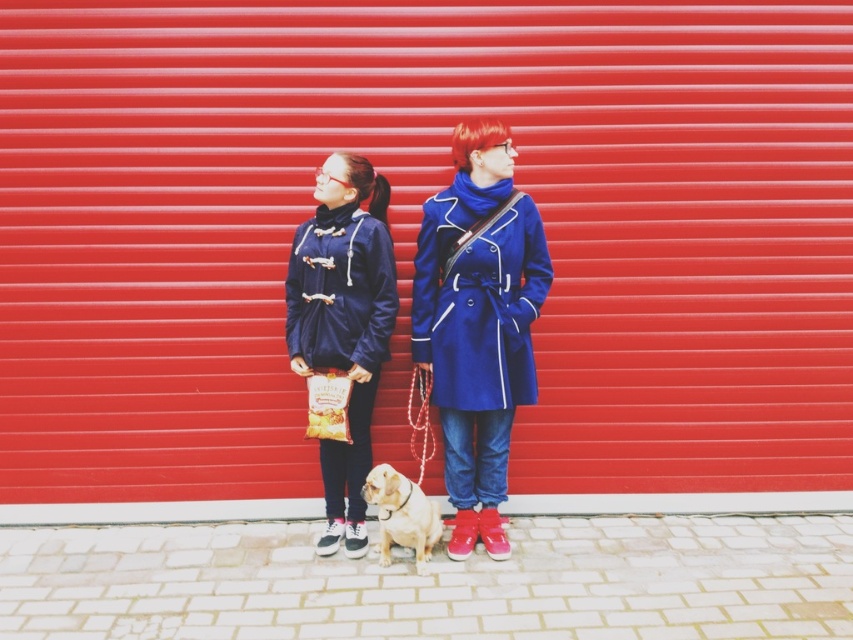
What do you see at coordinates (479, 321) in the screenshot?
I see `matte blue coat at center` at bounding box center [479, 321].

Does point (476, 221) lie behind point (345, 512)?

No, it is in front of (345, 512).

Describe the element at coordinates (479, 321) in the screenshot. This screenshot has height=640, width=853. I see `matte blue coat at center` at that location.

Find the location of `matte blue coat at center`. matte blue coat at center is located at coordinates (479, 321).

Is point (460, 552) positioned in front of point (445, 314)?

No.

Is matte blue coat at center taller than blue woolen coat at center?

Correct, matte blue coat at center is much taller as blue woolen coat at center.

Between point (480, 138) and point (494, 230), which one is positioned behind?

Point (494, 230)

At what (x,y) coordinates should I click in order to perform the action: click on matte blue coat at center. Please return your answer as a coordinate pair (x, y). This screenshot has width=853, height=640. Looking at the image, I should click on (479, 321).

Consider the image. Is matte blue coat at center taller than golden fur dog at center?

Correct, matte blue coat at center is much taller as golden fur dog at center.

Can you confirm if matte blue coat at center is wider than golden fur dog at center?

Correct, the width of matte blue coat at center exceeds that of golden fur dog at center.

Between point (515, 266) and point (389, 522), which one is positioned behind?

The point (515, 266) is more distant.

Locate an element on the screen. matte blue coat at center is located at coordinates (479, 321).